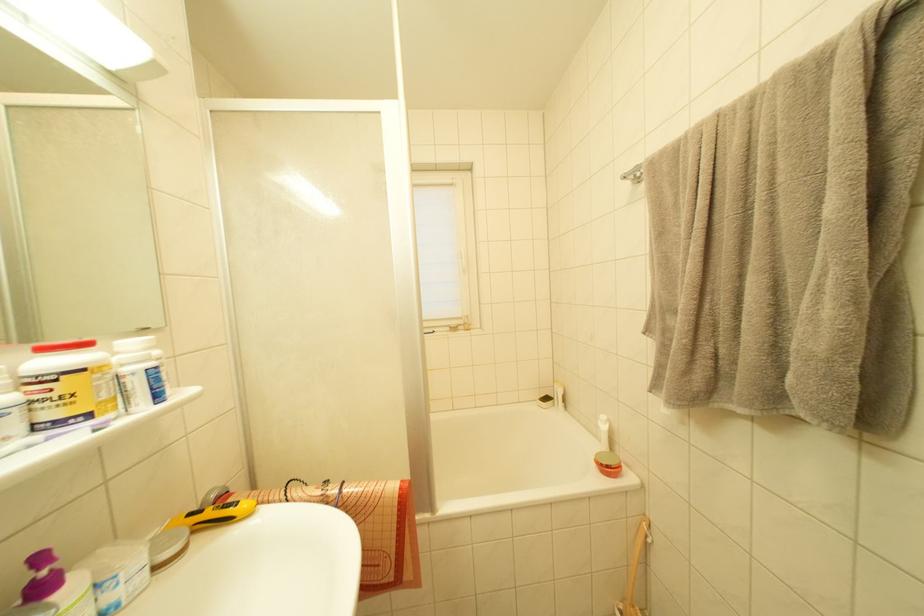
The image size is (924, 616). Describe the element at coordinates (71, 177) in the screenshot. I see `the mirror cabinet handle` at that location.